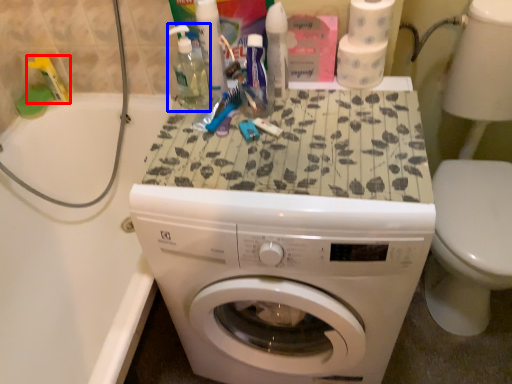
Question: Which point is closer to the camera, toiletry (highlighted by a red box) or cleaning product (highlighted by a blue box)?

Choices:
 (A) toiletry
 (B) cleaning product

Answer: (B)